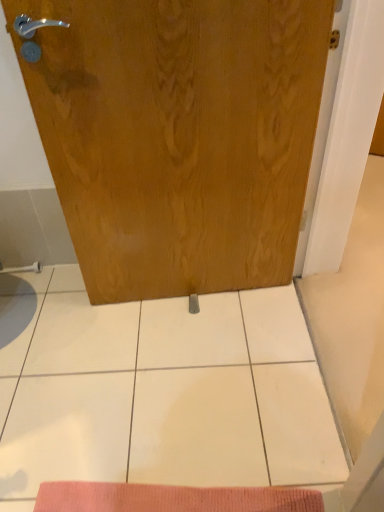
Locate an element on the screen. vacant space underneath wooden door at center (from a real-world perspective) is located at coordinates (198, 295).